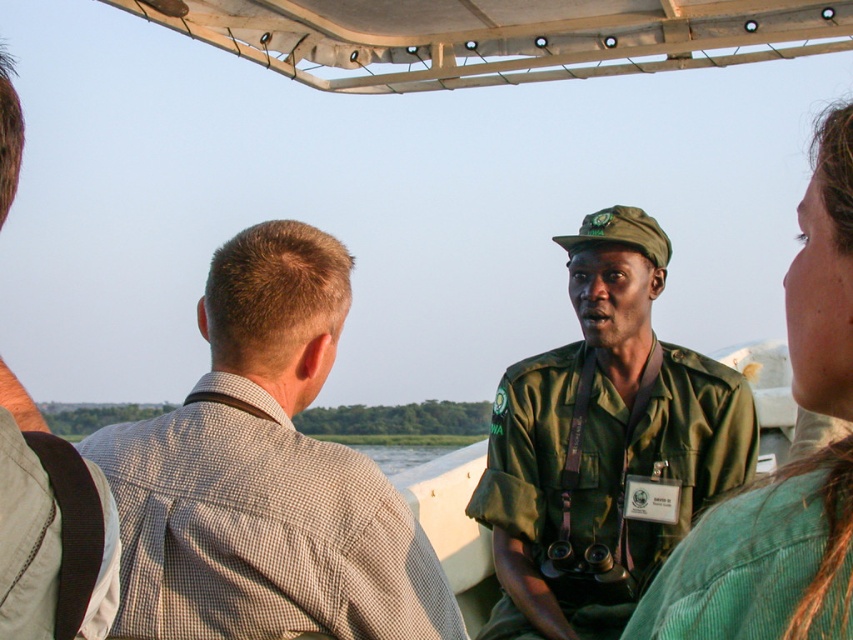
You are standing on a boat during a wildlife tour and see the green matte uniform at center. If you want to move closer to it, how many steps should you take if each step covers about 3 feet?

The green matte uniform at center is 19.59 feet away from you. Since each step covers about 3 feet, you would need to take approximately 7 steps to reach it.

You are a tour guide on a boat and need to quickly locate your two team members based on their clothing. The green matte uniform at center and the light brown fabric shirt at left are both visible. Which team member is closer to the front of the boat?

The light brown fabric shirt at left is behind the green matte uniform at center, so the green matte uniform at center is closer to the front of the boat.